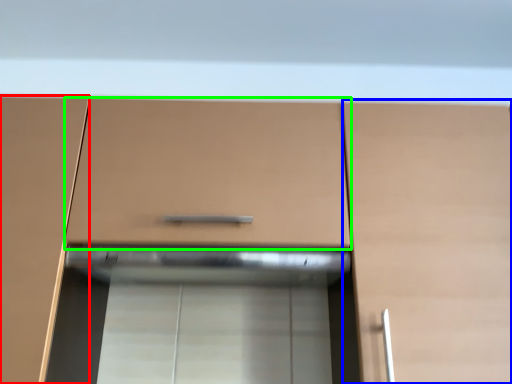
Question: Which object is the closest to the cabinetry (highlighted by a red box)? Choose among these: cabinetry (highlighted by a blue box) or drawer (highlighted by a green box).

Choices:
 (A) cabinetry
 (B) drawer

Answer: (B)